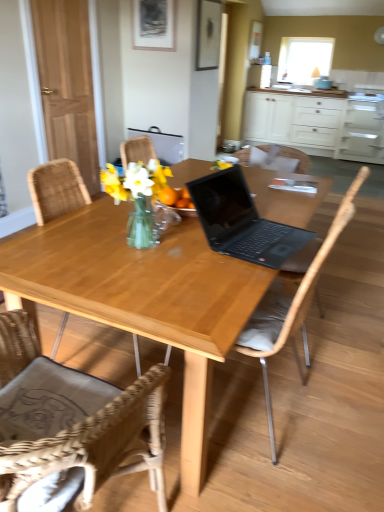
Find the location of a particular element. free location above light wood table at center (from a real-world perspective) is located at coordinates (173, 237).